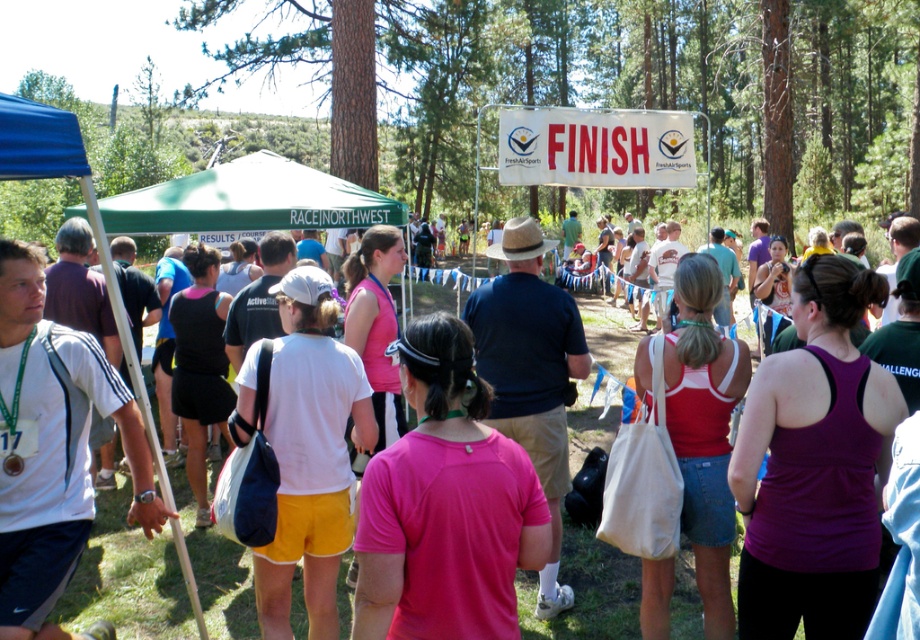
You are a photographer positioned at the center of the finish line area. You notice a participant wearing a pink fabric shirt at center. Where should you aim your camera to capture this participant in the frame?

The pink fabric shirt at center is located at point (445,506), so you should aim your camera towards the coordinates 0.791 on the x axis and 0.485 on the y axis to capture the participant wearing the pink fabric shirt at center.